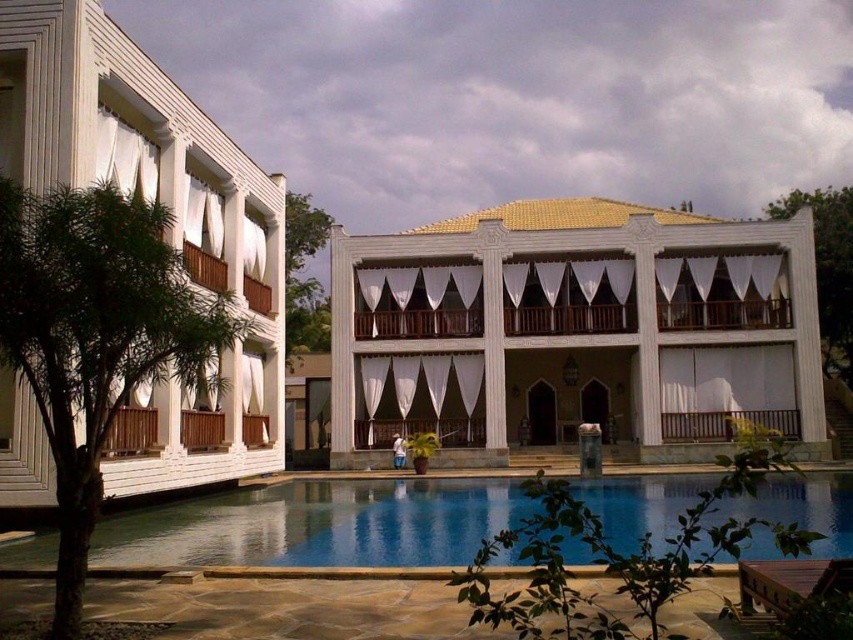
This screenshot has height=640, width=853. Identify the location of green leafy tree at left. (97, 337).

Which is behind, point (61, 630) or point (766, 216)?

The point (766, 216) is more distant.

Find the location of a particular element. green leafy tree at left is located at coordinates (97, 337).

Who is higher up, white matte building at left or green leafy tree at center?

green leafy tree at center is above.

Which is behind, point (157, 125) or point (294, 349)?

Point (294, 349)

Does point (231, 362) come farther from viewer compared to point (285, 208)?

That is False.

The image size is (853, 640). In order to click on white matte building at left in this screenshot , I will do `click(171, 228)`.

Which is more to the left, white textured building at center or white matte building at left?

white matte building at left is more to the left.

Identify the location of white textured building at center. (576, 326).